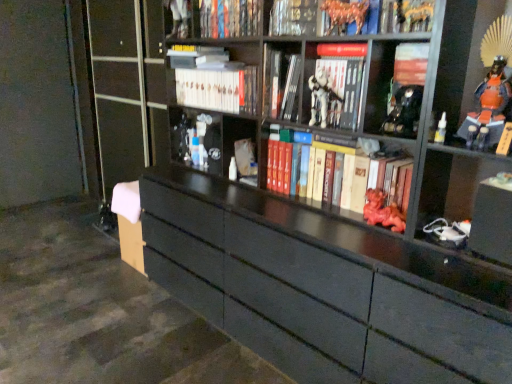
Find the location of a particular element. vacant space situated above hardcover book at upper center, the fourth book from the top (from a real-world perspective) is located at coordinates (346, 43).